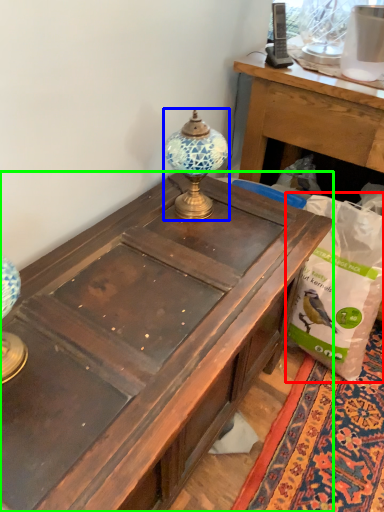
Question: Which object is the closest to the paper bag (highlighted by a red box)? Choose among these: lamp (highlighted by a blue box) or desk (highlighted by a green box).

Choices:
 (A) lamp
 (B) desk

Answer: (B)